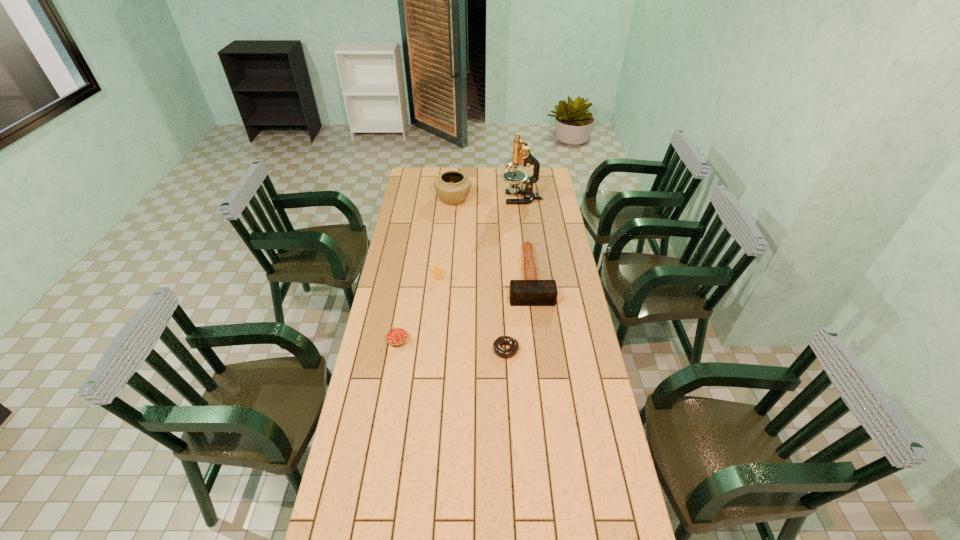
Identify the location of free space located on the back of the fifth shortest object. (456, 168).

Find the location of a particular element. The image size is (960, 540). free space located on the face of the Lego is located at coordinates (436, 294).

This screenshot has height=540, width=960. What are the coordinates of `free spot located 0.100m on the hammer head face of the mallet` in the screenshot? It's located at (535, 324).

Where is `blank space located 0.380m on the back of the fifth tallest object`? The height and width of the screenshot is (540, 960). blank space located 0.380m on the back of the fifth tallest object is located at coordinates (410, 269).

Identify the location of free location located 0.120m on the right of the shortest object. (549, 350).

This screenshot has width=960, height=540. I want to click on object that is at the left edge, so click(396, 337).

This screenshot has height=540, width=960. Find the location of `microscope that is positioned at the right edge`. microscope that is positioned at the right edge is located at coordinates (521, 154).

Locate an element on the screen. This screenshot has height=540, width=960. mallet located at the right edge is located at coordinates (530, 292).

In the image, there is a desktop. Identify the location of vacant space at the far edge. (463, 170).

I want to click on free region at the left edge of the desktop, so click(x=407, y=238).